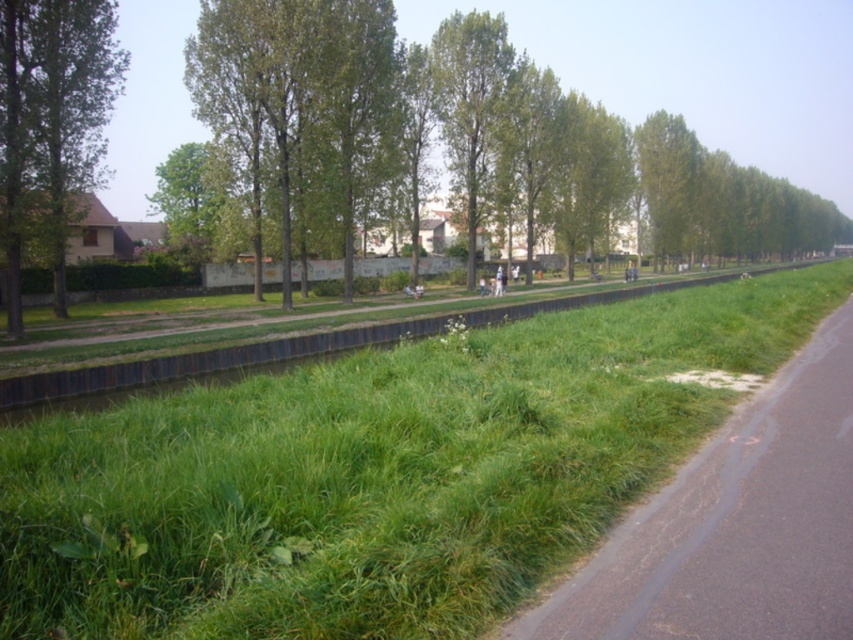
Is green grass at lower right below green leafy tree at upper left?

Yes, green grass at lower right is below green leafy tree at upper left.

Can you confirm if green grass at lower right is smaller than green leafy tree at upper left?

Indeed, green grass at lower right has a smaller size compared to green leafy tree at upper left.

Who is more forward, (815, 596) or (170, 157)?

Point (815, 596) is more forward.

Find the location of a particular element. Image resolution: width=853 pixels, height=640 pixels. green grass at lower right is located at coordinates (735, 524).

Does green grass at center have a greater width compared to green leafy tree at left?

Incorrect, green grass at center's width does not surpass green leafy tree at left's.

Does green grass at center come behind green leafy tree at left?

No, it is not.

Is point (115, 624) more distant than point (119, 51)?

No, it is in front of (119, 51).

Identify the location of green grass at center. The width and height of the screenshot is (853, 640). (374, 474).

Is green grass at lower right shorter than green leafy tree at left?

Yes, green grass at lower right is shorter than green leafy tree at left.

Is green grass at lower right above green leafy tree at left?

No.

Is point (811, 568) less distant than point (57, 113)?

Yes, it is.

Locate an element on the screen. The height and width of the screenshot is (640, 853). green grass at lower right is located at coordinates (735, 524).